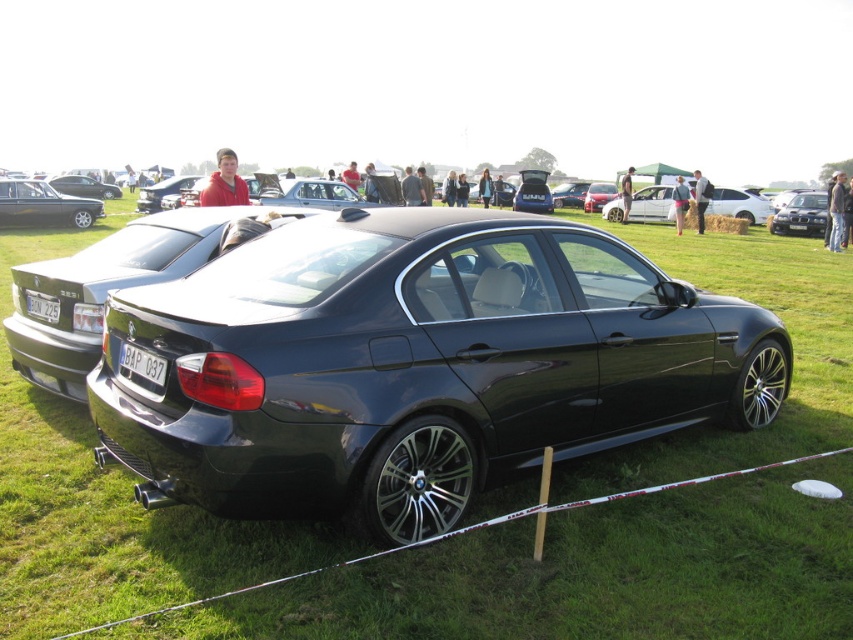
Image resolution: width=853 pixels, height=640 pixels. What do you see at coordinates (143, 364) in the screenshot? I see `black plastic license plate at rear` at bounding box center [143, 364].

Does black plastic license plate at rear appear on the right side of shiny black sedan at center?

Indeed, black plastic license plate at rear is positioned on the right side of shiny black sedan at center.

Between point (144, 349) and point (64, 184), which one is positioned in front?

Point (144, 349) is in front.

I want to click on black plastic license plate at rear, so click(143, 364).

Which is more to the right, metallic silver sedan at center or black plastic license plate at center?

black plastic license plate at center is more to the right.

Can you confirm if metallic silver sedan at center is positioned above black plastic license plate at center?

Correct, metallic silver sedan at center is located above black plastic license plate at center.

Find the location of a particular element. This screenshot has height=640, width=853. metallic silver sedan at center is located at coordinates (310, 193).

What are the coordinates of `metallic silver sedan at center` in the screenshot? It's located at (310, 193).

Does satin black sedan at center have a lesser width compared to black plastic license plate at center?

No.

In the scene shown: Is the position of satin black sedan at center more distant than that of black plastic license plate at center?

Yes, satin black sedan at center is behind black plastic license plate at center.

The height and width of the screenshot is (640, 853). Find the location of `satin black sedan at center`. satin black sedan at center is located at coordinates (801, 216).